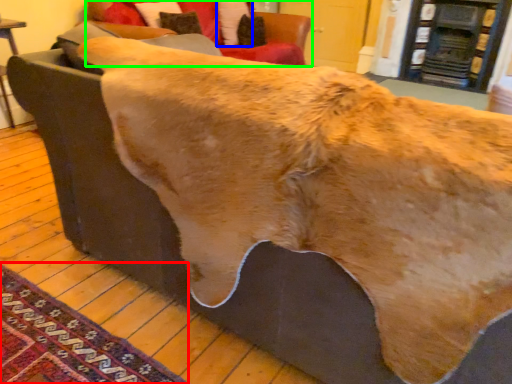
Question: Considering the real-world distances, which object is closest to mat (highlighted by a red box)? pillow (highlighted by a blue box) or studio couch (highlighted by a green box).

Choices:
 (A) pillow
 (B) studio couch

Answer: (B)